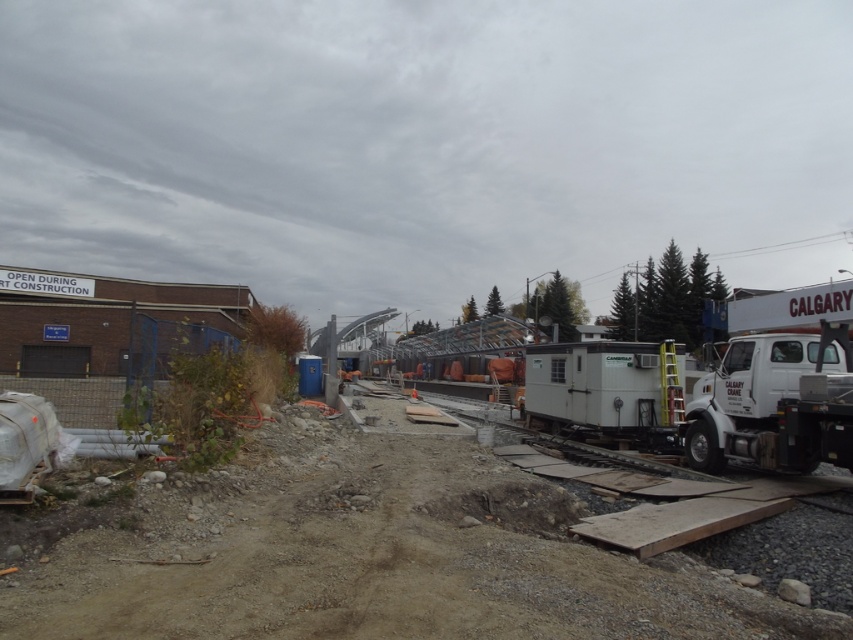
You are a delivery driver who needs to park your truck in the construction site. You have two options for parking spots next to the white matte trailer truck at right and the white matte trailer truck at center. Which parking spot would require a wider space to accommodate your truck?

The parking spot next to the white matte trailer truck at center would require a wider space because the white matte trailer truck at center is wider than the white matte trailer truck at right.

You are a delivery driver who needs to park your vehicle in a spot that can accommodate both the white metal trailer at center and the white matte trailer truck at center. Given that the parking space is only 10 meters long, can both vehicles fit side by side? Please consider their sizes as described.

The white metal trailer at center is larger in size compared to the white matte trailer truck at center. However, since the parking space is 10 meters long, both vehicles can fit side by side if their combined length does not exceed the space. The exact dimensions are not provided, so it depends on whether their total length is within the 10 meters.